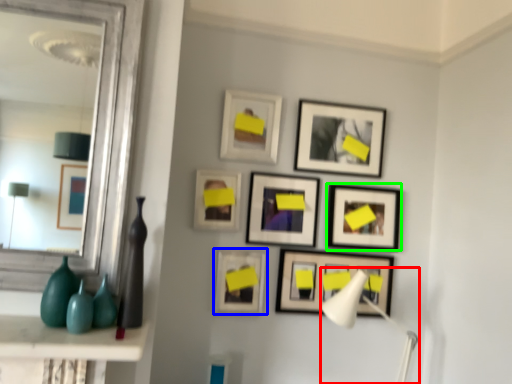
Question: Which object is the farthest from table lamp (highlighted by a red box)? Choose among these: picture frame (highlighted by a blue box) or picture frame (highlighted by a green box).

Choices:
 (A) picture frame
 (B) picture frame

Answer: (A)